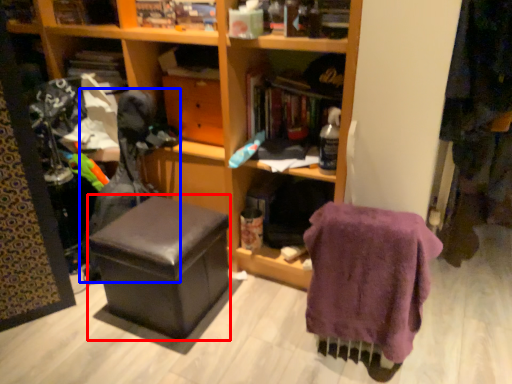
Question: Which object is further to the camera taking this photo, stool (highlighted by a red box) or swivel chair (highlighted by a blue box)?

Choices:
 (A) stool
 (B) swivel chair

Answer: (B)